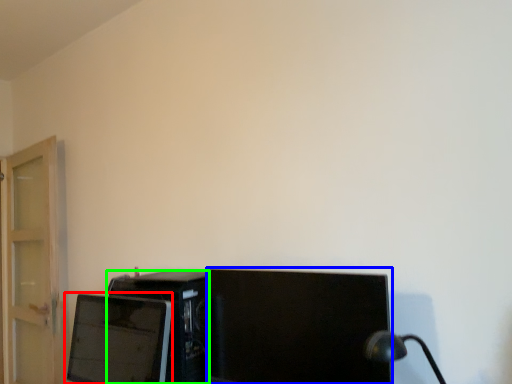
Question: Which object is positioned farthest from computer monitor (highlighted by a red box)? Select from computer monitor (highlighted by a blue box) and desktop computer (highlighted by a green box).

Choices:
 (A) computer monitor
 (B) desktop computer

Answer: (A)